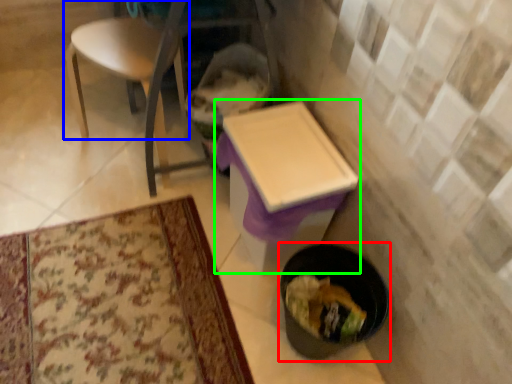
Question: Which is nearer to the potty (highlighted by a red box)? chair (highlighted by a blue box) or table (highlighted by a green box).

Choices:
 (A) chair
 (B) table

Answer: (B)